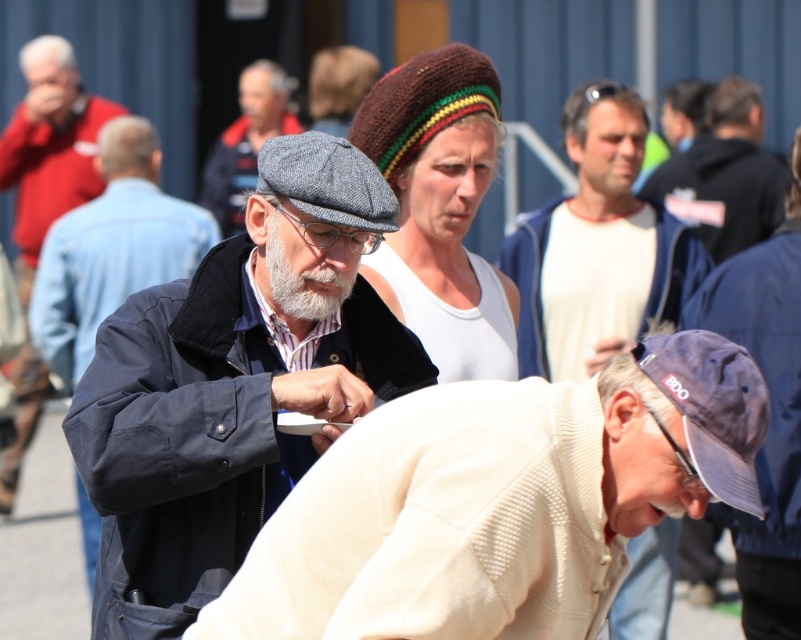
Question: Which is farther from the navy corduroy jacket at center?

Choices:
 (A) blue fleece jacket at upper center
 (B) matte black jacket at left
 (C) graywoolbeard at center
 (D) dark blue jacket at upper right

Answer: (B)

Question: Can you confirm if white textured jacket at lower center is bigger than blue fleece jacket at upper center?

Choices:
 (A) no
 (B) yes

Answer: (B)

Question: Which point appears closest to the camera in this image?

Choices:
 (A) (306, 275)
 (B) (93, 108)
 (C) (353, 198)
 (D) (733, 289)

Answer: (C)

Question: Does navy corduroy jacket at center have a greater width compared to matte black jacket at left?

Choices:
 (A) yes
 (B) no

Answer: (A)

Question: Which point is farther to the camera?

Choices:
 (A) dark blue jacket at left
 (B) navy corduroy jacket at center
 (C) blue fabric cap at lower right
 (D) gray woolen cap at center

Answer: (A)

Question: Can you confirm if navy blue fabric cap at lower right is thinner than knitted woolen hat at center?

Choices:
 (A) no
 (B) yes

Answer: (B)